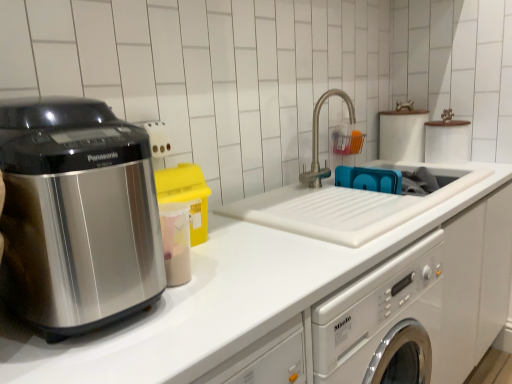
The height and width of the screenshot is (384, 512). What do you see at coordinates (221, 301) in the screenshot?
I see `white matte countertop at center` at bounding box center [221, 301].

What do you see at coordinates (77, 215) in the screenshot? I see `satin metallic appliance at left` at bounding box center [77, 215].

The width and height of the screenshot is (512, 384). What do you see at coordinates (318, 140) in the screenshot? I see `brushed metal faucet at center` at bounding box center [318, 140].

Where is `white matte countertop at center`? The height and width of the screenshot is (384, 512). white matte countertop at center is located at coordinates (221, 301).

The image size is (512, 384). In order to click on countertop on the right side of satin metallic appliance at left in this screenshot , I will do `click(221, 301)`.

Is white matte countertop at center to the left or to the right of satin metallic appliance at left in the image?

Based on their positions, white matte countertop at center is located to the right of satin metallic appliance at left.

From the image's perspective, is white matte countertop at center located above or below satin metallic appliance at left?

Clearly, from the image's perspective, white matte countertop at center is below satin metallic appliance at left.

From the image's perspective, is brushed metal faucet at center below satin metallic appliance at left?

No, from the image's perspective, brushed metal faucet at center is not beneath satin metallic appliance at left.

Image resolution: width=512 pixels, height=384 pixels. Find the location of `home appliance located on the left of brushed metal faucet at center`. home appliance located on the left of brushed metal faucet at center is located at coordinates (77, 215).

Looking at this image, from a real-world perspective, is brushed metal faucet at center above or below satin metallic appliance at left?

Clearly, from a real-world perspective, brushed metal faucet at center is below satin metallic appliance at left.

Is brushed metal faucet at center wider or thinner than satin metallic appliance at left?

In the image, brushed metal faucet at center appears to be more narrow than satin metallic appliance at left.

From a real-world perspective, which object rests below the other?

white matte countertop at center, from a real-world perspective.

Is brushed metal faucet at center aimed at white matte countertop at center?

No, brushed metal faucet at center is not facing towards white matte countertop at center.

Is brushed metal faucet at center at the right side of white matte countertop at center?

Yes, brushed metal faucet at center is to the right of white matte countertop at center.

From a real-world perspective, relative to brushed metal faucet at center, is white matte countertop at center vertically above or below?

Clearly, from a real-world perspective, white matte countertop at center is below brushed metal faucet at center.

From the image's perspective, between white matte countertop at center and brushed metal faucet at center, which one is located above?

brushed metal faucet at center appears higher in the image.

Considering the relative sizes of white matte countertop at center and brushed metal faucet at center in the image provided, is white matte countertop at center thinner than brushed metal faucet at center?

No, white matte countertop at center is not thinner than brushed metal faucet at center.

Can you tell me how much white matte countertop at center and brushed metal faucet at center differ in facing direction?

1.14 degrees.

Is satin metallic appliance at left to the left or to the right of brushed metal faucet at center in the image?

satin metallic appliance at left is to the left of brushed metal faucet at center.

From the image's perspective, is satin metallic appliance at left beneath brushed metal faucet at center?

Yes.

Considering the sizes of satin metallic appliance at left and brushed metal faucet at center in the image, is satin metallic appliance at left bigger or smaller than brushed metal faucet at center?

Clearly, satin metallic appliance at left is larger in size than brushed metal faucet at center.

Which point is more forward, (x=54, y=298) or (x=319, y=107)?

Point (x=54, y=298)

Is point (131, 275) closer or farther from the camera than point (395, 246)?

Point (131, 275).

Considering the relative sizes of satin metallic appliance at left and white matte countertop at center in the image provided, is satin metallic appliance at left wider than white matte countertop at center?

No, satin metallic appliance at left is not wider than white matte countertop at center.

Is satin metallic appliance at left not close to white matte countertop at center?

Actually, satin metallic appliance at left and white matte countertop at center are a little close together.

Is satin metallic appliance at left looking in the opposite direction of white matte countertop at center?

satin metallic appliance at left does not have its back to white matte countertop at center.

Identify the location of home appliance in front of the white matte countertop at center. (77, 215).

At what (x,y) coordinates should I click in order to perform the action: click on faucet beneath the satin metallic appliance at left (from a real-world perspective). Please return your answer as a coordinate pair (x, y). The image size is (512, 384). Looking at the image, I should click on (318, 140).

Considering their positions, is satin metallic appliance at left positioned further to brushed metal faucet at center than white matte countertop at center?

satin metallic appliance at left is positioned further to the anchor brushed metal faucet at center.

Considering their positions, is brushed metal faucet at center positioned closer to white matte countertop at center than satin metallic appliance at left?

The object closer to white matte countertop at center is satin metallic appliance at left.

Looking at this image, when comparing their distances from white matte countertop at center, does satin metallic appliance at left or brushed metal faucet at center seem further?

Among the two, brushed metal faucet at center is located further to white matte countertop at center.

Estimate the real-world distances between objects in this image. Which object is further from brushed metal faucet at center, white matte countertop at center or satin metallic appliance at left?

satin metallic appliance at left is further to brushed metal faucet at center.

Based on their spatial positions, is brushed metal faucet at center or white matte countertop at center closer to satin metallic appliance at left?

white matte countertop at center lies closer to satin metallic appliance at left than the other object.

Which object lies nearer to the anchor point satin metallic appliance at left, white matte countertop at center or brushed metal faucet at center?

Based on the image, white matte countertop at center appears to be nearer to satin metallic appliance at left.

Identify the location of countertop located between satin metallic appliance at left and brushed metal faucet at center in the depth direction. The height and width of the screenshot is (384, 512). (221, 301).